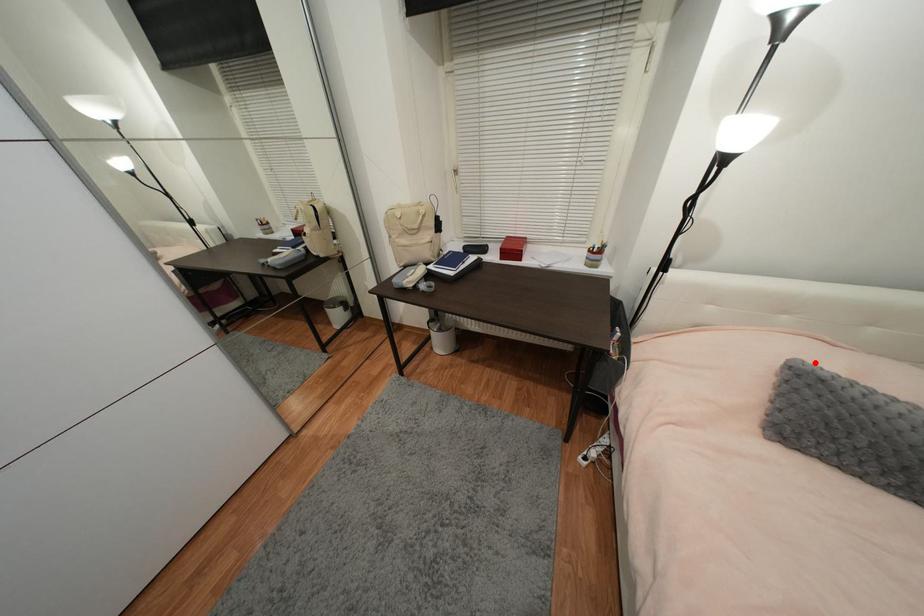
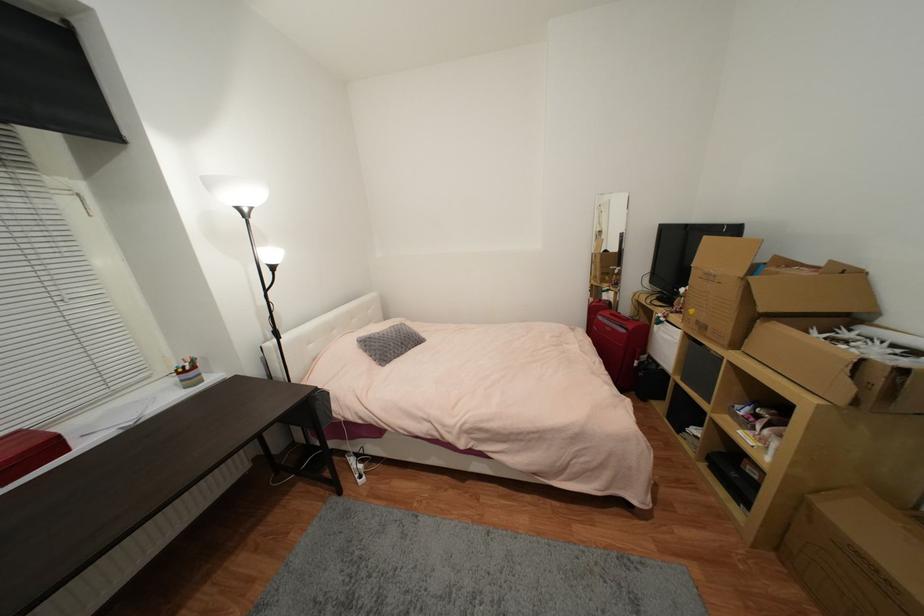
Where in the second image is the point corresponding to the highlighted location from the first image?

(365, 338)